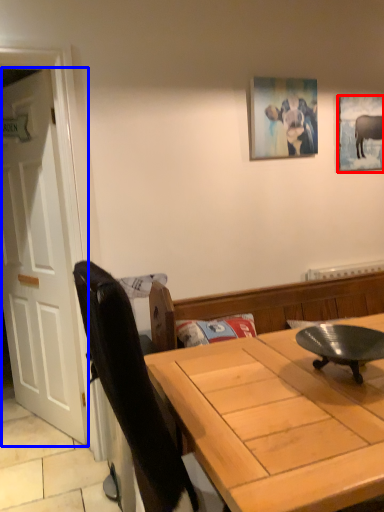
Question: Among these objects, which one is nearest to the camera, picture frame (highlighted by a red box) or door (highlighted by a blue box)?

Choices:
 (A) picture frame
 (B) door

Answer: (B)